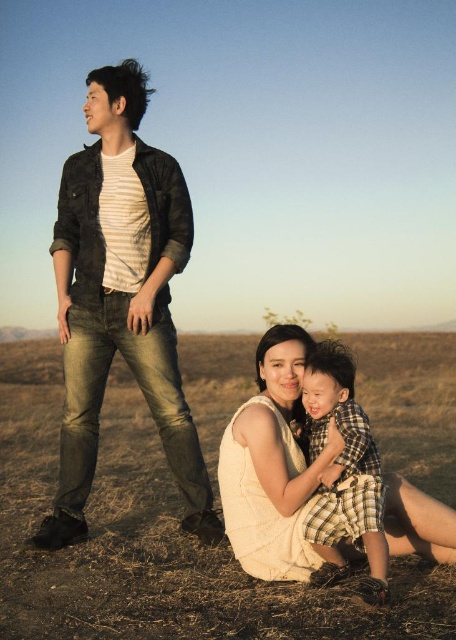
Between denim jeans at left and white sleeveless dress at lower center, which one is positioned lower?

Positioned lower is white sleeveless dress at lower center.

Who is positioned more to the right, denim jeans at left or white sleeveless dress at lower center?

From the viewer's perspective, white sleeveless dress at lower center appears more on the right side.

I want to click on denim jeans at left, so click(x=120, y=298).

Can you confirm if brown grass at lower center is positioned to the left of denim jeans at left?

Yes, brown grass at lower center is to the left of denim jeans at left.

Is brown grass at lower center shorter than denim jeans at left?

Correct, brown grass at lower center is not as tall as denim jeans at left.

Is point (114, 493) positioned behind point (165, 362)?

Yes, point (114, 493) is farther from viewer.

Where is `brown grass at lower center`? brown grass at lower center is located at coordinates (151, 540).

Which of these two, white sleeveless dress at lower center or plaid fabric baby at center, stands shorter?

Standing shorter between the two is plaid fabric baby at center.

Who is taller, white sleeveless dress at lower center or plaid fabric baby at center?

white sleeveless dress at lower center

Image resolution: width=456 pixels, height=640 pixels. Identify the location of white sleeveless dress at lower center. (271, 465).